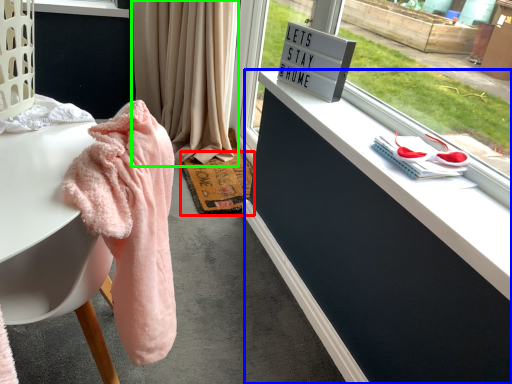
Question: Which object is positioned closest to mat (highlighted by a red box)? Select from dresser (highlighted by a blue box) and curtain (highlighted by a green box).

Choices:
 (A) dresser
 (B) curtain

Answer: (B)